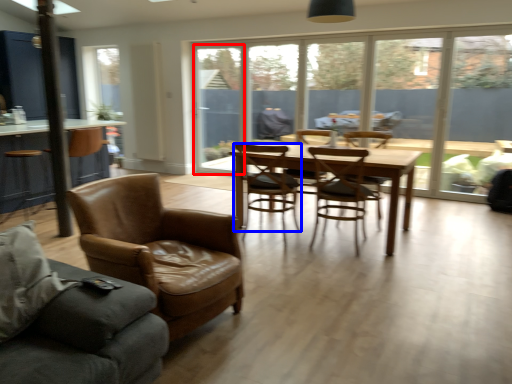
Question: Which object is closer to the camera taking this photo, window screen (highlighted by a red box) or chair (highlighted by a blue box)?

Choices:
 (A) window screen
 (B) chair

Answer: (B)